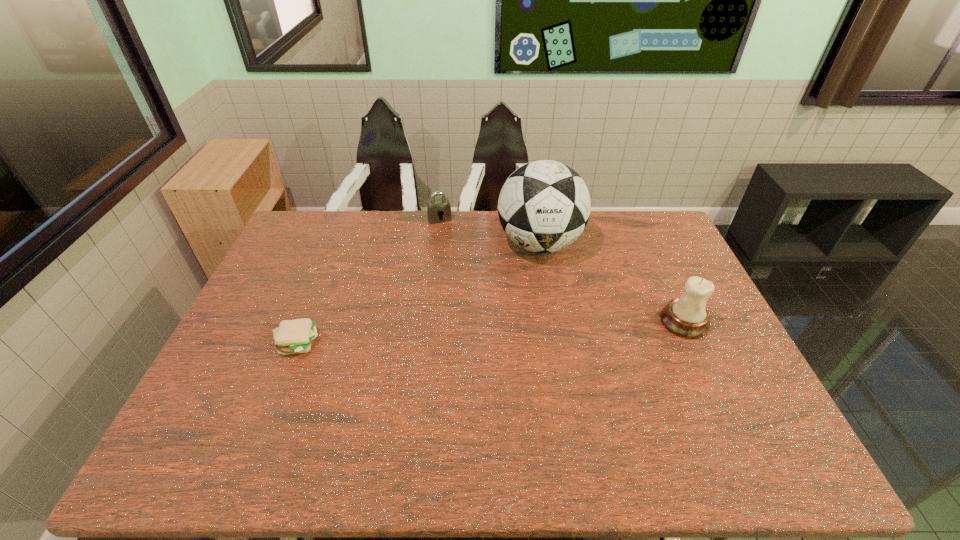
Find the location of a particular element. The image size is (960, 540). vacant space located 0.180m on the surface of the third object from left to right where the brand logo is visible is located at coordinates (485, 297).

Where is `free space located 0.140m on the surface of the third object from left to right where the brand logo is visible`? Image resolution: width=960 pixels, height=540 pixels. free space located 0.140m on the surface of the third object from left to right where the brand logo is visible is located at coordinates (492, 290).

At what (x,y) coordinates should I click in order to perform the action: click on vacant space located on the surface of the third object from left to right where the brand logo is visible. Please return your answer as a coordinate pair (x, y). This screenshot has width=960, height=540. Looking at the image, I should click on (480, 301).

Find the location of a particular element. free space located 0.360m at the front of the padlock near the keyhole is located at coordinates (471, 288).

Identify the location of free space located 0.230m at the front of the padlock near the keyhole. (460, 262).

Image resolution: width=960 pixels, height=540 pixels. Identify the location of vacant space located at the front of the padlock near the keyhole. (455, 251).

At what (x,y) coordinates should I click in order to perform the action: click on soccer ball that is at the far edge. Please return your answer as a coordinate pair (x, y). Looking at the image, I should click on (544, 206).

Identify the location of padlock located in the far edge section of the desktop. This screenshot has height=540, width=960. (440, 208).

Locate an element on the screen. The width and height of the screenshot is (960, 540). object that is at the left edge is located at coordinates (292, 336).

This screenshot has height=540, width=960. In order to click on object that is at the right edge in this screenshot , I will do `click(687, 317)`.